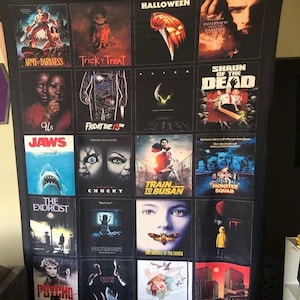
Find the location of a particular element. halloween poster is located at coordinates (161, 30).